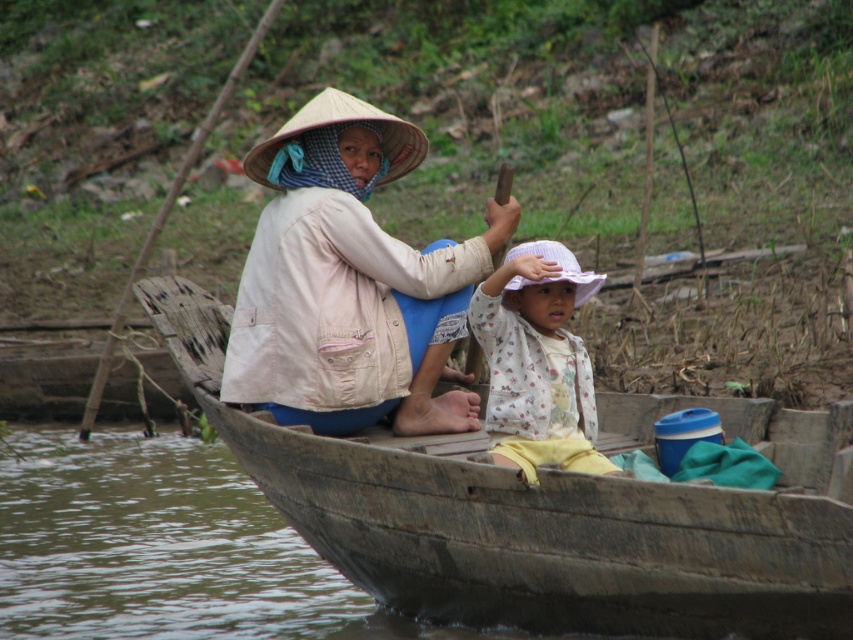
You are standing on the dock and see the wooden boat at center and the white floral shirt at center. Which object is wider?

The white floral shirt at center is wider than the wooden boat at center.

What is the location of the point with coordinates (550, 513) in the image?

The point with coordinates (550, 513) is located on the wooden boat at center.